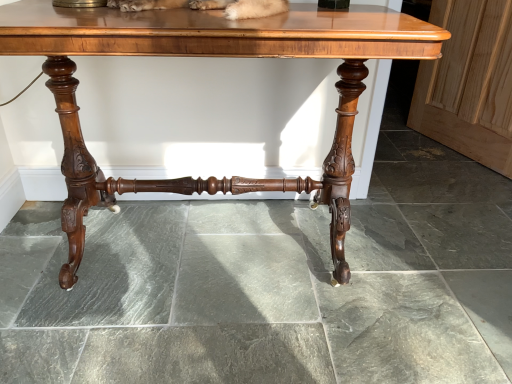
Find the location of `vacant area in front of polished wood table at center`. vacant area in front of polished wood table at center is located at coordinates (198, 340).